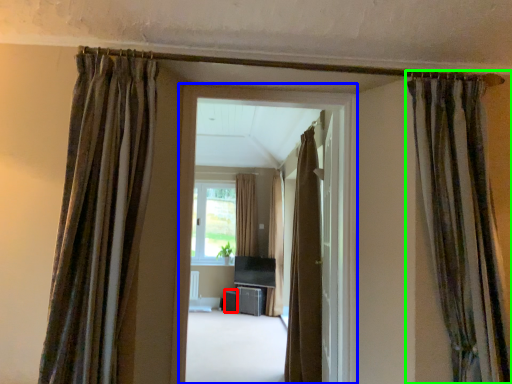
Question: Which object is positioned closest to furniture (highlighted by a red box)? Select from window frame (highlighted by a blue box) and curtain (highlighted by a green box).

Choices:
 (A) window frame
 (B) curtain

Answer: (A)